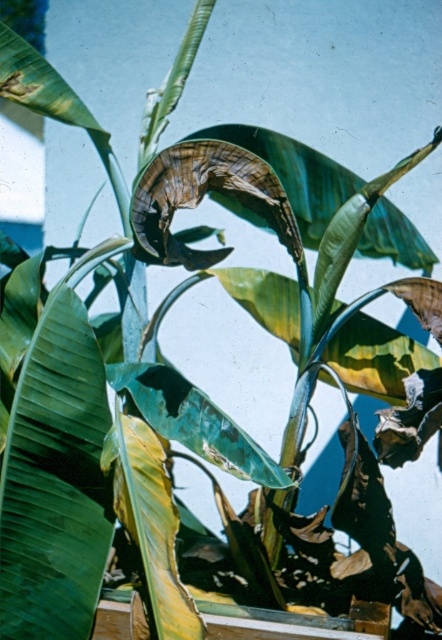
Is green matte leaf at center taller than green matte banana leaf at center?

Correct, green matte leaf at center is much taller as green matte banana leaf at center.

Who is lower down, green matte leaf at center or green matte banana leaf at center?

Positioned lower is green matte banana leaf at center.

Does point (52, 632) lie in front of point (168, 561)?

No, (52, 632) is further to viewer.

Find the location of a particular element. The width and height of the screenshot is (442, 640). green matte leaf at center is located at coordinates (54, 481).